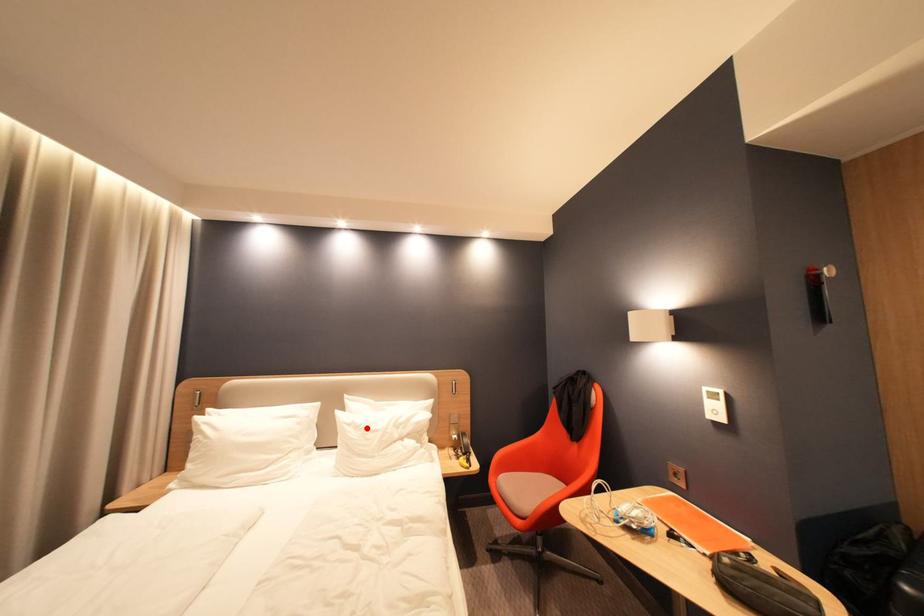
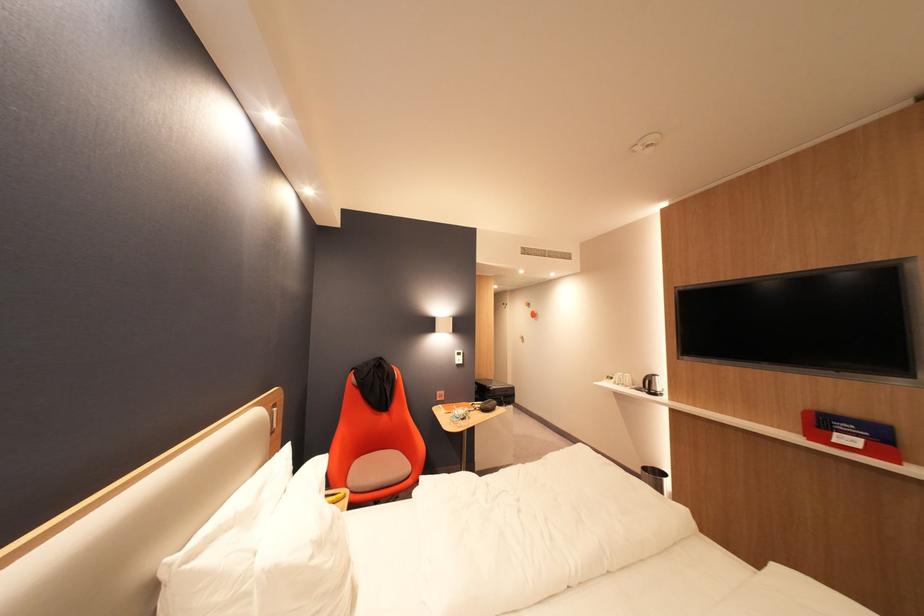
Find the pixel in the second image that matches the highlighted location in the first image.

(330, 545)